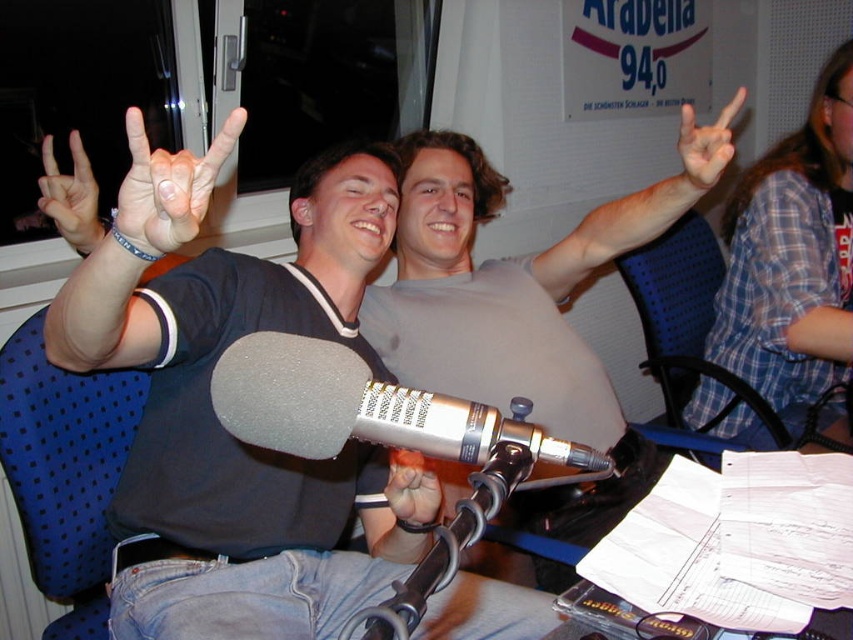
From the picture: Can you confirm if matte black hand at upper left is taller than smooth skin hand at center?

Incorrect, matte black hand at upper left's height is not larger of smooth skin hand at center's.

Is matte black hand at upper left bigger than smooth skin hand at center?

No, matte black hand at upper left is not bigger than smooth skin hand at center.

Which is in front, point (160, 221) or point (433, 500)?

Point (160, 221) is in front.

This screenshot has height=640, width=853. Find the location of `matte black hand at upper left`. matte black hand at upper left is located at coordinates (169, 186).

Who is taller, silver/metallic microphone at center or white matte hand at upper right?

white matte hand at upper right is taller.

Which is above, silver/metallic microphone at center or white matte hand at upper right?

Positioned higher is white matte hand at upper right.

Where is `silver/metallic microphone at center`? The image size is (853, 640). silver/metallic microphone at center is located at coordinates (373, 413).

Does matte black hand at upper left have a lesser width compared to white matte hand at upper right?

Yes.

Does matte black hand at upper left have a smaller size compared to white matte hand at upper right?

Correct, matte black hand at upper left occupies less space than white matte hand at upper right.

At what (x,y) coordinates should I click in order to perform the action: click on matte black hand at upper left. Please return your answer as a coordinate pair (x, y). This screenshot has width=853, height=640. Looking at the image, I should click on (169, 186).